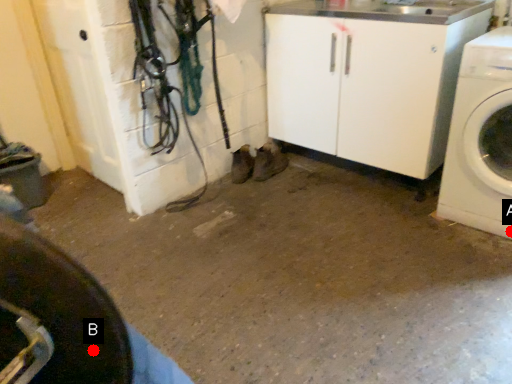
Question: Two points are circled on the image, labeled by A and B beside each circle. Which point is farther from the camera taking this photo?

Choices:
 (A) A is further
 (B) B is further

Answer: (A)